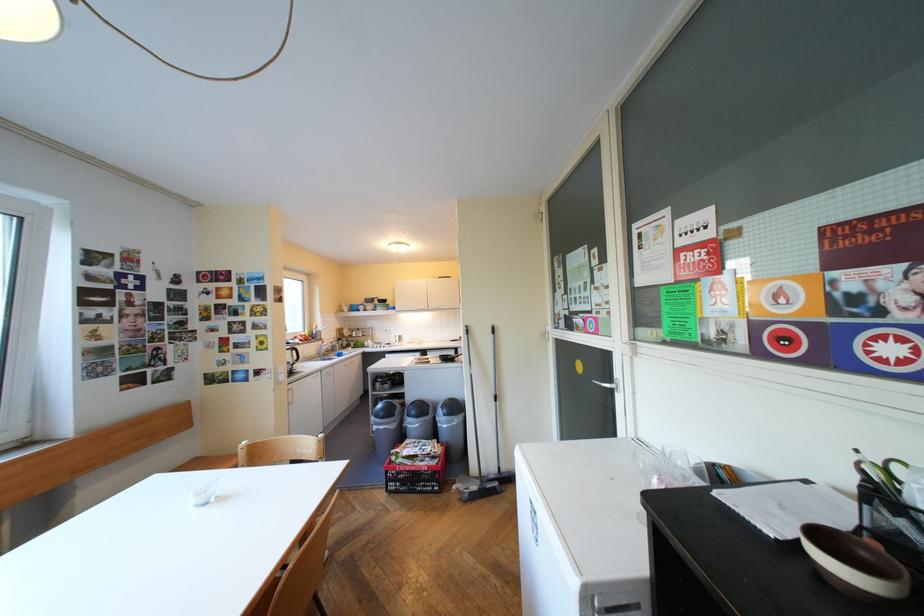
Find where to pull the silver cabinet handle. Please return your answer as a coordinate pair (x, y).

(608, 384)